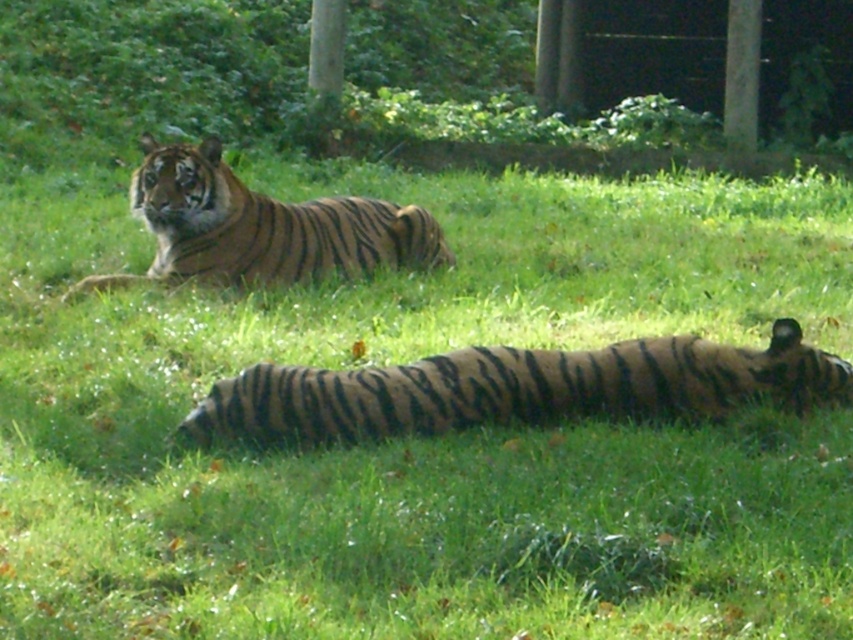
Is striped fur tiger at lower center positioned before orange-brown striped tiger at upper center?

That is True.

Between point (300, 417) and point (207, 276), which one is positioned in front?

Positioned in front is point (300, 417).

Locate an element on the screen. The height and width of the screenshot is (640, 853). striped fur tiger at lower center is located at coordinates (519, 388).